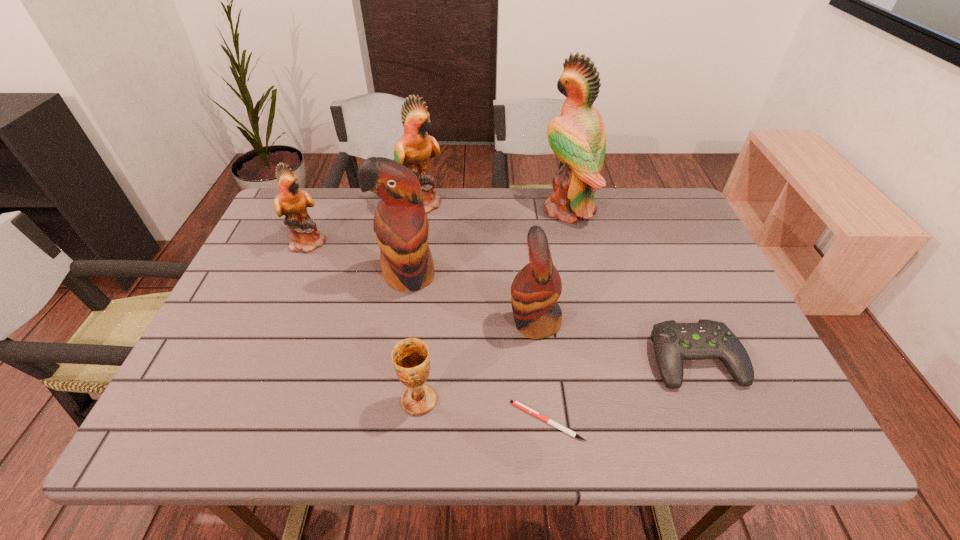
Where is `control`? The image size is (960, 540). control is located at coordinates (673, 342).

Where is `the rightmost object`? Image resolution: width=960 pixels, height=540 pixels. the rightmost object is located at coordinates (673, 342).

Find the location of `the shortest object`. the shortest object is located at coordinates (517, 404).

Identify the location of pen. (517, 404).

Identify the location of vacant space located on the front-facing side of the tallest object. The image size is (960, 540). (444, 210).

Find the location of a particular element. The image size is (960, 540). vacant point located 0.050m on the front-facing side of the tallest object is located at coordinates (523, 210).

Where is `free spot located 0.130m on the front-facing side of the tallest object`? Image resolution: width=960 pixels, height=540 pixels. free spot located 0.130m on the front-facing side of the tallest object is located at coordinates (498, 210).

Where is `free location located 0.180m on the front-facing side of the second smallest green parrot`? free location located 0.180m on the front-facing side of the second smallest green parrot is located at coordinates (501, 203).

The image size is (960, 540). In order to click on free space located 0.290m on the face of the bigger red parrot in this screenshot , I will do `click(388, 404)`.

At what (x,y) coordinates should I click in order to perform the action: click on vacant space located 0.080m on the front-facing side of the leftmost green parrot. Please return your answer as a coordinate pair (x, y). The height and width of the screenshot is (540, 960). Looking at the image, I should click on (356, 242).